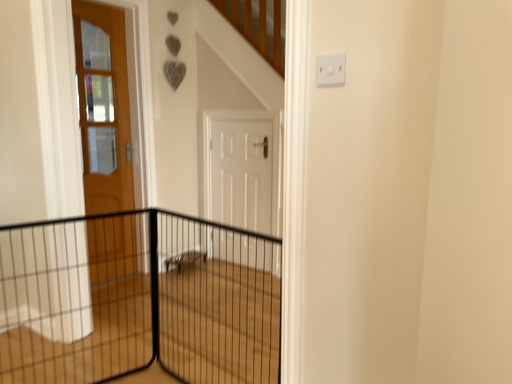
Question: Considering the relative sizes of matte wooden door at left, which ranks as the 1th door in left-to-right order, and black wire mesh at center in the image provided, is matte wooden door at left, which ranks as the 1th door in left-to-right order, shorter than black wire mesh at center?

Choices:
 (A) no
 (B) yes

Answer: (A)

Question: Is matte wooden door at left, arranged as the second door when viewed from the right, to the right of black wire mesh at center from the viewer's perspective?

Choices:
 (A) no
 (B) yes

Answer: (A)

Question: Can you confirm if matte wooden door at left, which ranks as the 1th door in left-to-right order, is bigger than black wire mesh at center?

Choices:
 (A) yes
 (B) no

Answer: (B)

Question: From a real-world perspective, is matte wooden door at left, arranged as the second door when viewed from the right, located higher than black wire mesh at center?

Choices:
 (A) yes
 (B) no

Answer: (A)

Question: From a real-world perspective, is matte wooden door at left, which ranks as the 1th door in left-to-right order, physically below black wire mesh at center?

Choices:
 (A) yes
 (B) no

Answer: (B)

Question: Considering the relative positions of white plastic electric outlet at upper right and white matte door at center, which is the 2th door from left to right, in the image provided, is white plastic electric outlet at upper right to the left or to the right of white matte door at center, which is the 2th door from left to right,?

Choices:
 (A) left
 (B) right

Answer: (B)

Question: From the image's perspective, relative to white matte door at center, which is the 2th door from left to right, is white plastic electric outlet at upper right above or below?

Choices:
 (A) below
 (B) above

Answer: (B)

Question: Is point (342, 54) closer or farther from the camera than point (224, 185)?

Choices:
 (A) farther
 (B) closer

Answer: (B)

Question: From a real-world perspective, is white plastic electric outlet at upper right above or below white matte door at center, which is the 2th door from left to right?

Choices:
 (A) above
 (B) below

Answer: (A)

Question: Looking at their shapes, would you say black wire mesh fence at left is wider or thinner than matte wooden door at left, arranged as the second door when viewed from the right?

Choices:
 (A) wide
 (B) thin

Answer: (A)

Question: Considering the positions of black wire mesh fence at left and matte wooden door at left, arranged as the second door when viewed from the right, in the image, is black wire mesh fence at left bigger or smaller than matte wooden door at left, arranged as the second door when viewed from the right,?

Choices:
 (A) big
 (B) small

Answer: (A)

Question: Relative to matte wooden door at left, arranged as the second door when viewed from the right, is black wire mesh fence at left in front or behind?

Choices:
 (A) front
 (B) behind

Answer: (A)

Question: From the image's perspective, relative to matte wooden door at left, which ranks as the 1th door in left-to-right order, is black wire mesh fence at left above or below?

Choices:
 (A) above
 (B) below

Answer: (B)

Question: From a real-world perspective, is white matte door at center, which is the 2th door from left to right, physically located above or below black wire mesh fence at left?

Choices:
 (A) above
 (B) below

Answer: (A)

Question: Based on their positions, is white matte door at center, which is the 2th door from left to right, located to the left or right of black wire mesh fence at left?

Choices:
 (A) right
 (B) left

Answer: (A)